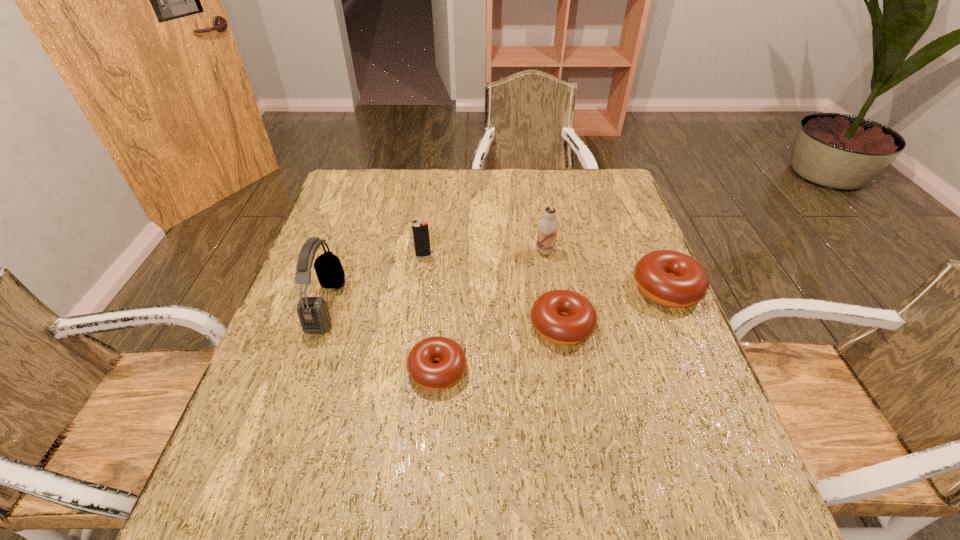
The doughnuts are evenly distributed in the image. To maintain this, where would you place another doughnut on the left? Please point to a free space. Please provide its 2D coordinates. Your answer should be formatted as a tuple, i.e. [(x, y)], where the tuple contains the x and y coordinates of a point satisfying the conditions above.

[(288, 423)]